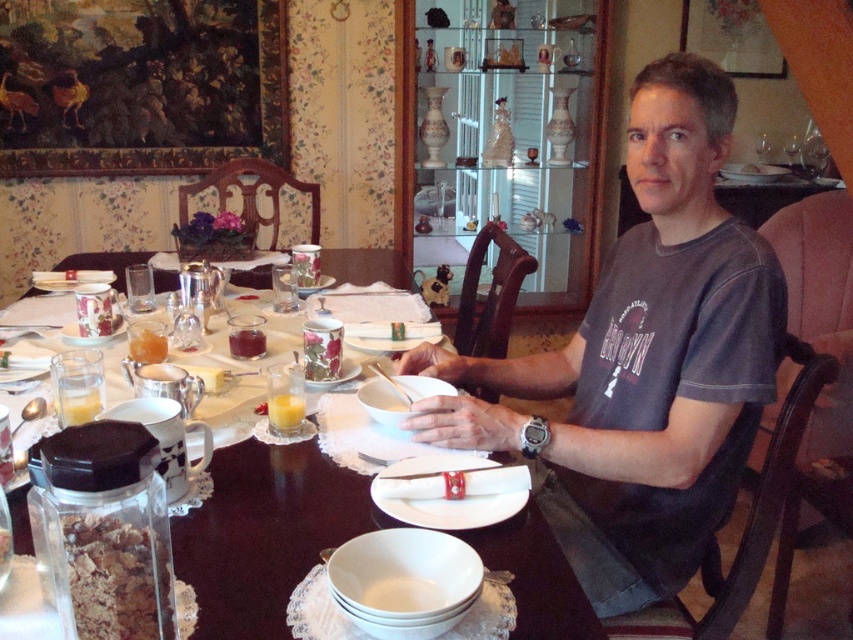
Who is positioned more to the left, white matte plate at center or white porcelain plate at center?

white porcelain plate at center

Find the location of a particular element. white matte plate at center is located at coordinates [x=447, y=497].

Where is `white matte plate at center`? This screenshot has height=640, width=853. white matte plate at center is located at coordinates (447, 497).

Where is `white matte plate at center`? The image size is (853, 640). white matte plate at center is located at coordinates point(447,497).

Who is more distant from viewer, (361, 490) or (746, 164)?

The point (746, 164) is more distant.

The height and width of the screenshot is (640, 853). What do you see at coordinates (265, 532) in the screenshot?
I see `white porcelain table at center` at bounding box center [265, 532].

Who is more distant from viewer, (525, 589) or (723, 164)?

Point (723, 164)

In order to click on white porcelain table at center in this screenshot , I will do `click(265, 532)`.

Is gray cotton t-shirt at center to the right of white matte plate at center from the viewer's perspective?

Yes, gray cotton t-shirt at center is to the right of white matte plate at center.

You are a GUI agent. You are given a task and a screenshot of the screen. Output one action in this format:
    pyautogui.click(x=<x>, y=<y>)
    Task: Click on the gray cotton t-shirt at center
    
    Given the screenshot: What is the action you would take?
    pyautogui.click(x=643, y=362)